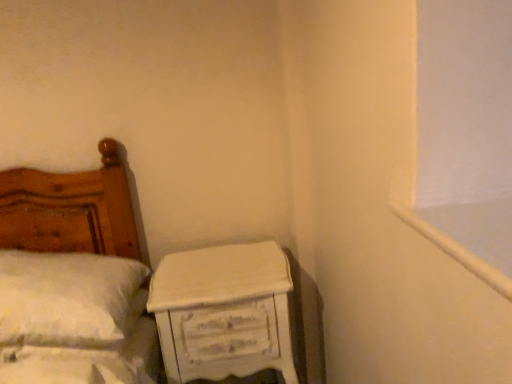
Question: From the image's perspective, is white painted wood at upper right under white distressed wood nightstand at lower right?

Choices:
 (A) no
 (B) yes

Answer: (A)

Question: Is white painted wood at upper right facing towards white distressed wood nightstand at lower right?

Choices:
 (A) no
 (B) yes

Answer: (A)

Question: Considering the relative sizes of white painted wood at upper right and white distressed wood nightstand at lower right in the image provided, is white painted wood at upper right smaller than white distressed wood nightstand at lower right?

Choices:
 (A) yes
 (B) no

Answer: (A)

Question: Considering the relative positions of white painted wood at upper right and white distressed wood nightstand at lower right in the image provided, is white painted wood at upper right in front of white distressed wood nightstand at lower right?

Choices:
 (A) yes
 (B) no

Answer: (A)

Question: Is white painted wood at upper right wider than white distressed wood nightstand at lower right?

Choices:
 (A) yes
 (B) no

Answer: (B)

Question: Would you say white painted wood at upper right is outside white distressed wood nightstand at lower right?

Choices:
 (A) no
 (B) yes

Answer: (B)

Question: Is white painted wood at upper right outside white fluffy pillow at left?

Choices:
 (A) yes
 (B) no

Answer: (A)

Question: Is white painted wood at upper right at the left side of white fluffy pillow at left?

Choices:
 (A) yes
 (B) no

Answer: (B)

Question: Is white painted wood at upper right next to white fluffy pillow at left and touching it?

Choices:
 (A) no
 (B) yes

Answer: (A)

Question: From the image's perspective, is white painted wood at upper right beneath white fluffy pillow at left?

Choices:
 (A) yes
 (B) no

Answer: (B)

Question: Is there a large distance between white painted wood at upper right and white fluffy pillow at left?

Choices:
 (A) no
 (B) yes

Answer: (A)

Question: Is white painted wood at upper right positioned before white fluffy pillow at left?

Choices:
 (A) yes
 (B) no

Answer: (A)

Question: Can you confirm if white fluffy pillow at left is wider than white distressed wood nightstand at lower right?

Choices:
 (A) yes
 (B) no

Answer: (A)